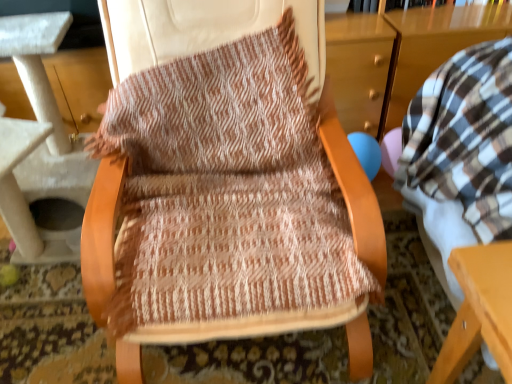
Question: From the image's perspective, relative to woven fabric chair at center, is white textured cat tree at left above or below?

Choices:
 (A) below
 (B) above

Answer: (B)

Question: Considering the positions of white textured cat tree at left and woven fabric chair at center in the image, is white textured cat tree at left bigger or smaller than woven fabric chair at center?

Choices:
 (A) big
 (B) small

Answer: (A)

Question: From a real-world perspective, relative to woven fabric chair at center, is white textured cat tree at left vertically above or below?

Choices:
 (A) above
 (B) below

Answer: (B)

Question: Considering the positions of woven fabric chair at center and white textured cat tree at left in the image, is woven fabric chair at center wider or thinner than white textured cat tree at left?

Choices:
 (A) wide
 (B) thin

Answer: (B)

Question: Do you think woven fabric chair at center is within white textured cat tree at left, or outside of it?

Choices:
 (A) inside
 (B) outside

Answer: (B)

Question: Looking at the image, does woven fabric chair at center seem bigger or smaller compared to white textured cat tree at left?

Choices:
 (A) big
 (B) small

Answer: (B)

Question: From the image's perspective, is woven fabric chair at center located above or below white textured cat tree at left?

Choices:
 (A) above
 (B) below

Answer: (B)